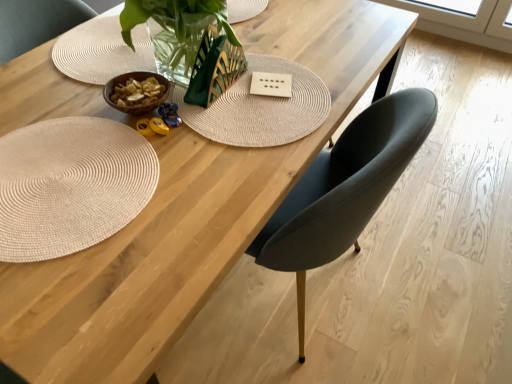
Image resolution: width=512 pixels, height=384 pixels. What are the coordinates of `vacant space to the right of natural woven mat at lower left` in the screenshot? It's located at (199, 215).